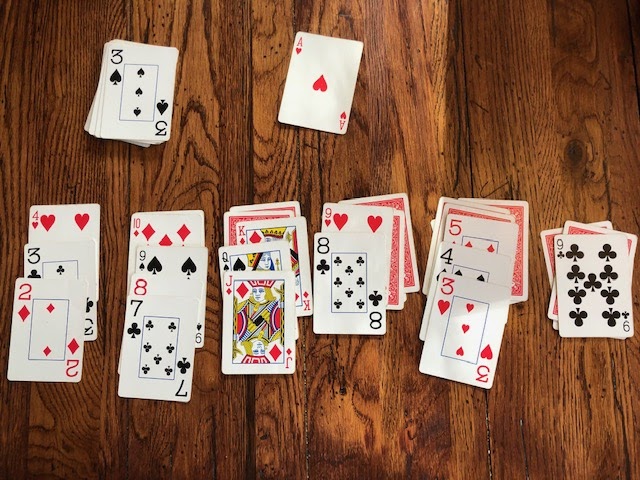
Where is `shadow on table`? The width and height of the screenshot is (640, 480). shadow on table is located at coordinates (593, 23).